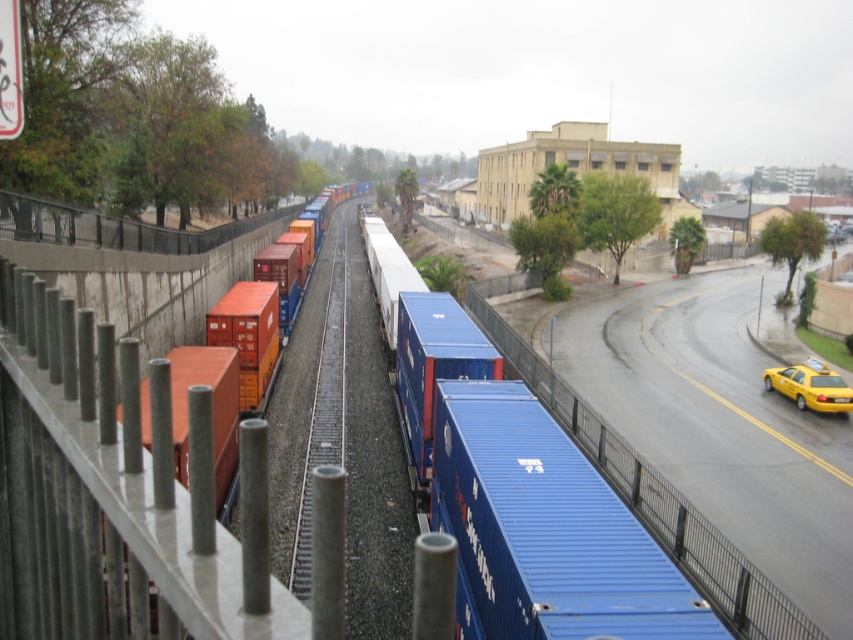
Question: Which object is closer to the camera taking this photo?

Choices:
 (A) yellow matte taxi at lower right
 (B) orange matte container at center
 (C) blue metal train track at center
 (D) blue matte container at center

Answer: (B)

Question: Is blue matte container at center thinner than blue metal train track at center?

Choices:
 (A) no
 (B) yes

Answer: (B)

Question: Among these points, which one is nearest to the camera?

Choices:
 (A) (517, 552)
 (B) (339, 465)

Answer: (A)

Question: Is blue matte container at center behind orange matte container at center?

Choices:
 (A) yes
 (B) no

Answer: (A)

Question: Which point is closer to the camera?

Choices:
 (A) (815, 372)
 (B) (335, 256)
 (C) (184, 376)

Answer: (C)

Question: Is blue metal train track at center smaller than orange matte container at center?

Choices:
 (A) no
 (B) yes

Answer: (B)